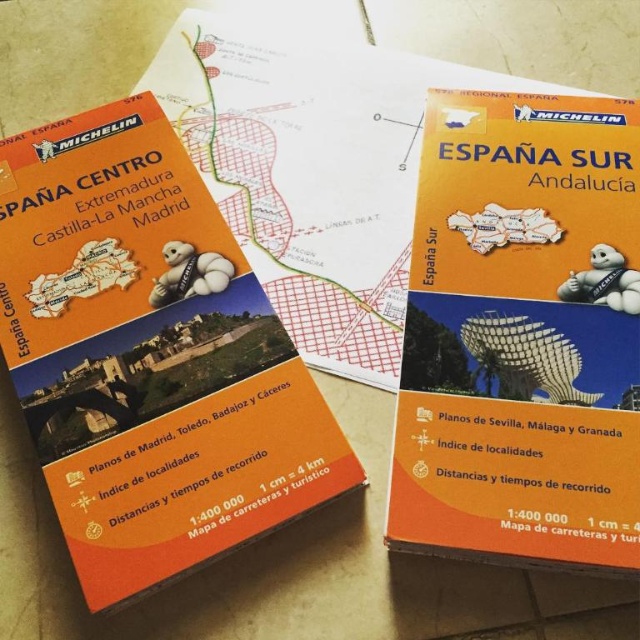
Between orange matte map at upper right and metallic bird at center, which one is positioned higher?

orange matte map at upper right

Who is shorter, orange matte map at upper right or metallic bird at center?

With less height is metallic bird at center.

This screenshot has width=640, height=640. What do you see at coordinates (518, 337) in the screenshot?
I see `orange matte map at upper right` at bounding box center [518, 337].

Where is `orange matte map at upper right`? Image resolution: width=640 pixels, height=640 pixels. orange matte map at upper right is located at coordinates (518, 337).

Does point (232, 355) lie in front of point (166, 244)?

Yes, point (232, 355) is in front of point (166, 244).

Who is higher up, orange matte map at upper left or white plush toy at center?

Positioned higher is white plush toy at center.

Which is behind, point (266, 490) or point (198, 252)?

The point (198, 252) is behind.

Locate an element on the screen. The width and height of the screenshot is (640, 640). orange matte map at upper left is located at coordinates (147, 358).

Is orange matte map at upper left shorter than orange matte map at upper right?

Incorrect, orange matte map at upper left's height does not fall short of orange matte map at upper right's.

Measure the distance between orange matte map at upper left and orange matte map at upper right.

orange matte map at upper left and orange matte map at upper right are 14.73 inches apart.

Where is `orange matte map at upper left`? The width and height of the screenshot is (640, 640). orange matte map at upper left is located at coordinates (147, 358).